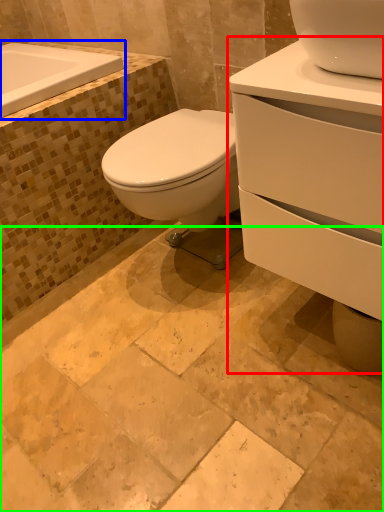
Question: Which object is the closest to the porcelain (highlighted by a red box)? Choose among these: bath (highlighted by a blue box) or ceramic tile (highlighted by a green box).

Choices:
 (A) bath
 (B) ceramic tile

Answer: (B)